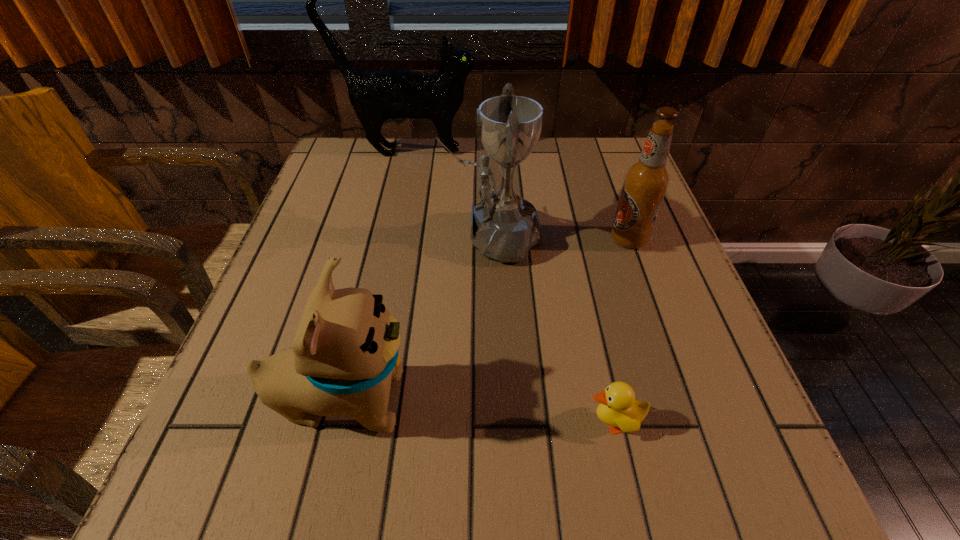
Find the location of `blank space located 0.310m on the side with emblem of the award`. blank space located 0.310m on the side with emblem of the award is located at coordinates (301, 238).

Find the location of a particular element. This screenshot has height=540, width=960. blank space located 0.150m on the front label of the rightmost object is located at coordinates pyautogui.click(x=540, y=239).

Where is `free space located on the front label of the rightmost object`? This screenshot has height=540, width=960. free space located on the front label of the rightmost object is located at coordinates (495, 239).

At what (x,y) coordinates should I click in order to perform the action: click on blank space located 0.180m on the front label of the rightmost object. Please return your answer as a coordinate pair (x, y). Looking at the image, I should click on (527, 239).

This screenshot has height=540, width=960. What are the coordinates of `vacant space located on the face of the puppy` in the screenshot? It's located at (476, 399).

Locate an element on the screen. The width and height of the screenshot is (960, 540). free space located on the front-facing side of the duckling is located at coordinates (403, 422).

Identify the location of vacant region located 0.140m on the front-facing side of the duckling. This screenshot has height=540, width=960. (494, 422).

Identify the location of free space located 0.270m on the front-facing side of the duckling. (410, 422).

Identify the location of object that is positioned at the far edge. Image resolution: width=960 pixels, height=540 pixels. (376, 95).

This screenshot has height=540, width=960. I want to click on cat at the left edge, so click(376, 95).